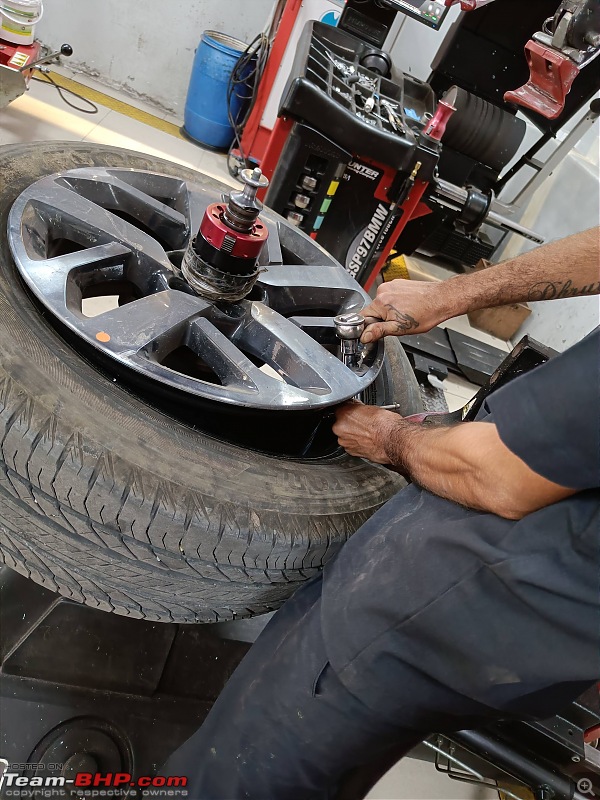
Identify the location of wall. This screenshot has height=800, width=600. (167, 36).